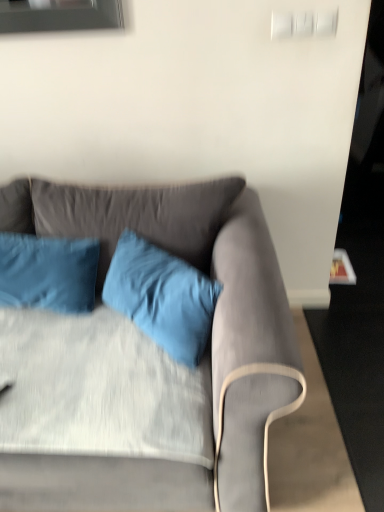
Locate an element on the screen. This screenshot has height=512, width=384. blue satin pillow at left, the 2th pillow positioned from the right is located at coordinates (48, 273).

Image resolution: width=384 pixels, height=512 pixels. Describe the element at coordinates (48, 273) in the screenshot. I see `blue satin pillow at left, which ranks as the 1th pillow in left-to-right order` at that location.

What is the approximate height of matte gray couch at center?

The height of matte gray couch at center is 86.56 centimeters.

Locate an element on the screen. blue satin pillow at left, which ranks as the 1th pillow in left-to-right order is located at coordinates (48, 273).

Is velvet blue pillow at center, which appears as the second pillow when viewed from the left, further to camera compared to blue satin pillow at left, the 2th pillow positioned from the right?

That is False.

Are velvet blue pillow at center, which appears as the second pillow when viewed from the left, and blue satin pillow at left, the 2th pillow positioned from the right, far apart?

No, velvet blue pillow at center, which appears as the second pillow when viewed from the left, is not far away from blue satin pillow at left, the 2th pillow positioned from the right.

Is velvet blue pillow at center, the first pillow when ordered from right to left, turned away from blue satin pillow at left, the 2th pillow positioned from the right?

That's not correct — velvet blue pillow at center, the first pillow when ordered from right to left, is not looking away from blue satin pillow at left, the 2th pillow positioned from the right.

From a real-world perspective, is blue satin pillow at left, the 2th pillow positioned from the right, on matte gray couch at center?

Yes.

Would you say blue satin pillow at left, which ranks as the 1th pillow in left-to-right order, is outside matte gray couch at center?

No, blue satin pillow at left, which ranks as the 1th pillow in left-to-right order, is inside or overlapping with matte gray couch at center.

From the image's perspective, is blue satin pillow at left, the 2th pillow positioned from the right, located above or below matte gray couch at center?

blue satin pillow at left, the 2th pillow positioned from the right, is above matte gray couch at center.

At what (x,y) coordinates should I click in order to perform the action: click on pillow on the left of matte gray couch at center. Please return your answer as a coordinate pair (x, y). The image size is (384, 512). Looking at the image, I should click on (48, 273).

Is matte gray couch at center oriented away from blue satin pillow at left, which ranks as the 1th pillow in left-to-right order?

Correct, matte gray couch at center is looking away from blue satin pillow at left, which ranks as the 1th pillow in left-to-right order.

Can you confirm if matte gray couch at center is smaller than blue satin pillow at left, the 2th pillow positioned from the right?

No.

Would you say matte gray couch at center is a long distance from blue satin pillow at left, the 2th pillow positioned from the right?

That's not correct — matte gray couch at center is a little close to blue satin pillow at left, the 2th pillow positioned from the right.

Which object is positioned more to the right, matte gray couch at center or blue satin pillow at left, the 2th pillow positioned from the right?

From the viewer's perspective, matte gray couch at center appears more on the right side.

How many degrees apart are the facing directions of matte gray couch at center and velvet blue pillow at center, the first pillow when ordered from right to left?

48.1 degrees separate the facing orientations of matte gray couch at center and velvet blue pillow at center, the first pillow when ordered from right to left.

Is matte gray couch at center outside of velvet blue pillow at center, the first pillow when ordered from right to left?

Yes, matte gray couch at center is located beyond the bounds of velvet blue pillow at center, the first pillow when ordered from right to left.

Is matte gray couch at center in front of velvet blue pillow at center, the first pillow when ordered from right to left?

Yes, the depth of matte gray couch at center is less than that of velvet blue pillow at center, the first pillow when ordered from right to left.

Can you confirm if velvet blue pillow at center, the first pillow when ordered from right to left, is positioned to the right of matte gray couch at center?

Correct, you'll find velvet blue pillow at center, the first pillow when ordered from right to left, to the right of matte gray couch at center.

The image size is (384, 512). I want to click on studio couch below the velvet blue pillow at center, which appears as the second pillow when viewed from the left (from the image's perspective), so click(146, 362).

Could you tell me if velvet blue pillow at center, which appears as the second pillow when viewed from the left, is turned towards matte gray couch at center?

Yes.

From the image's perspective, is velvet blue pillow at center, the first pillow when ordered from right to left, below matte gray couch at center?

No, from the image's perspective, velvet blue pillow at center, the first pillow when ordered from right to left, is not below matte gray couch at center.

How different are the orientations of blue satin pillow at left, the 2th pillow positioned from the right, and velvet blue pillow at center, the first pillow when ordered from right to left, in degrees?

They differ by 39.4 degrees in their facing directions.

Can you confirm if blue satin pillow at left, the 2th pillow positioned from the right, is positioned to the right of velvet blue pillow at center, which appears as the second pillow when viewed from the left?

No.

Considering the positions of points (0, 252) and (187, 351), is point (0, 252) closer to camera compared to point (187, 351)?

That is False.

Considering the relative sizes of blue satin pillow at left, which ranks as the 1th pillow in left-to-right order, and velvet blue pillow at center, the first pillow when ordered from right to left, in the image provided, is blue satin pillow at left, which ranks as the 1th pillow in left-to-right order, shorter than velvet blue pillow at center, the first pillow when ordered from right to left,?

Correct, blue satin pillow at left, which ranks as the 1th pillow in left-to-right order, is not as tall as velvet blue pillow at center, the first pillow when ordered from right to left.

This screenshot has width=384, height=512. What are the coordinates of `pillow below the blue satin pillow at left, the 2th pillow positioned from the right (from the image's perspective)` in the screenshot? It's located at (162, 297).

Locate an element on the screen. pillow on the left side of matte gray couch at center is located at coordinates tap(48, 273).

Estimate the real-world distances between objects in this image. Which object is further from velvet blue pillow at center, which appears as the second pillow when viewed from the left, matte gray couch at center or blue satin pillow at left, which ranks as the 1th pillow in left-to-right order?

The object further to velvet blue pillow at center, which appears as the second pillow when viewed from the left, is blue satin pillow at left, which ranks as the 1th pillow in left-to-right order.

From the image, which object appears to be farther from matte gray couch at center, velvet blue pillow at center, the first pillow when ordered from right to left, or blue satin pillow at left, which ranks as the 1th pillow in left-to-right order?

Among the two, blue satin pillow at left, which ranks as the 1th pillow in left-to-right order, is located further to matte gray couch at center.

Which object lies further to the anchor point matte gray couch at center, blue satin pillow at left, which ranks as the 1th pillow in left-to-right order, or velvet blue pillow at center, which appears as the second pillow when viewed from the left?

blue satin pillow at left, which ranks as the 1th pillow in left-to-right order, is positioned further to the anchor matte gray couch at center.

Estimate the real-world distances between objects in this image. Which object is closer to blue satin pillow at left, which ranks as the 1th pillow in left-to-right order, velvet blue pillow at center, the first pillow when ordered from right to left, or matte gray couch at center?

Among the two, velvet blue pillow at center, the first pillow when ordered from right to left, is located nearer to blue satin pillow at left, which ranks as the 1th pillow in left-to-right order.

From the image, which object appears to be nearer to velvet blue pillow at center, the first pillow when ordered from right to left, blue satin pillow at left, the 2th pillow positioned from the right, or matte gray couch at center?

The object closer to velvet blue pillow at center, the first pillow when ordered from right to left, is matte gray couch at center.

Which object lies nearer to the anchor point blue satin pillow at left, which ranks as the 1th pillow in left-to-right order, matte gray couch at center or velvet blue pillow at center, which appears as the second pillow when viewed from the left?

velvet blue pillow at center, which appears as the second pillow when viewed from the left, lies closer to blue satin pillow at left, which ranks as the 1th pillow in left-to-right order, than the other object.

Locate an element on the screen. pillow between matte gray couch at center and blue satin pillow at left, which ranks as the 1th pillow in left-to-right order, in the front-back direction is located at coordinates (162, 297).